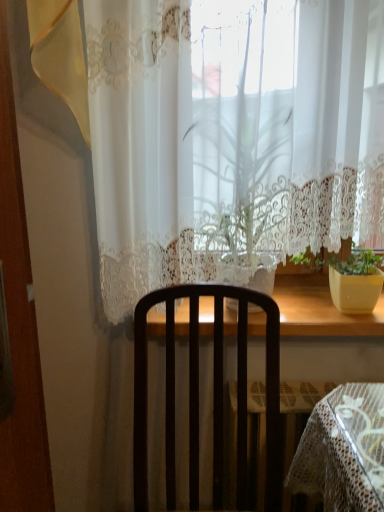
The height and width of the screenshot is (512, 384). What are the coordinates of `vacant space to the left of yellow matte pot at right` in the screenshot? It's located at (309, 314).